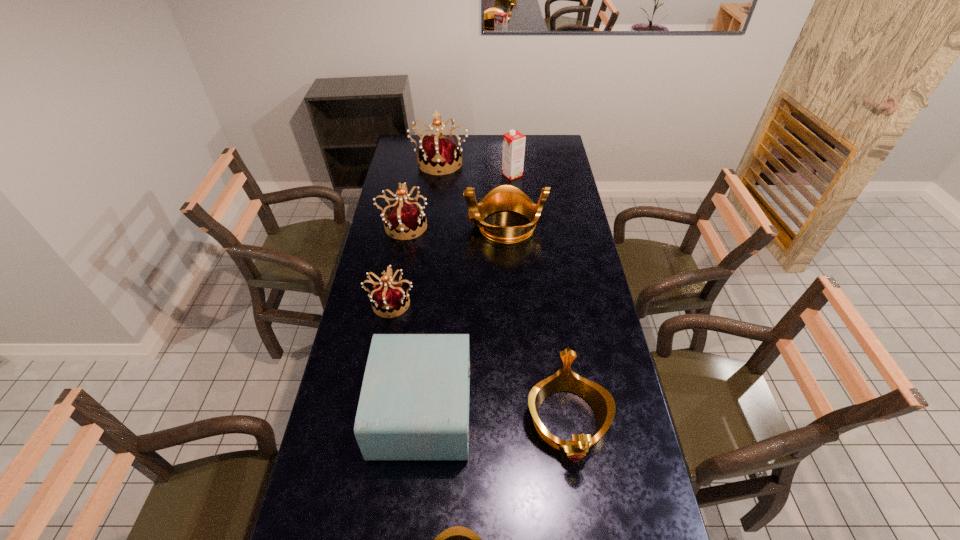
Locate an element on the screen. This screenshot has width=960, height=540. free space between the farthest tiara and the carton is located at coordinates (476, 168).

You are a GUI agent. You are given a task and a screenshot of the screen. Output one action in this format:
    pyautogui.click(x=<x>, y=<y>)
    Task: Click on the object that is the nearest to the second smallest gold tiara
    Image resolution: width=960 pixels, height=540 pixels.
    Given the screenshot: What is the action you would take?
    pyautogui.click(x=414, y=403)

I want to click on object that stands as the sixth closest to the radio receiver, so click(513, 142).

You are a GUI agent. You are given a task and a screenshot of the screen. Output one action in this format:
    pyautogui.click(x=<x>, y=<y>)
    Task: Click on the tiara that is the fifth closest to the radio receiver
    
    Given the screenshot: What is the action you would take?
    pyautogui.click(x=404, y=217)

What are the coordinates of `tiara object that ranks as the fourth closest to the nearest object` in the screenshot? It's located at (404, 217).

Where is `red tiara object that ranks as the third closest to the second biggest gold tiara`? This screenshot has height=540, width=960. red tiara object that ranks as the third closest to the second biggest gold tiara is located at coordinates (440, 153).

Locate an element on the screen. The height and width of the screenshot is (540, 960). the second closest red tiara to the second biggest red tiara is located at coordinates (440, 153).

Where is `gold tiara object that ranks as the third closest to the radio receiver`? gold tiara object that ranks as the third closest to the radio receiver is located at coordinates (506, 197).

Where is `the third closest gold tiara to the smallest red tiara`? The image size is (960, 540). the third closest gold tiara to the smallest red tiara is located at coordinates (457, 539).

You are a GUI agent. You are given a task and a screenshot of the screen. Output one action in this format:
    pyautogui.click(x=<x>, y=<y>)
    Task: Click on the vacant space that satisfies the following two spatial constraints: 1. on the front-facing side of the tallest object; 2. on the left side of the carton
    Image resolution: width=960 pixels, height=540 pixels.
    Given the screenshot: What is the action you would take?
    pyautogui.click(x=439, y=175)